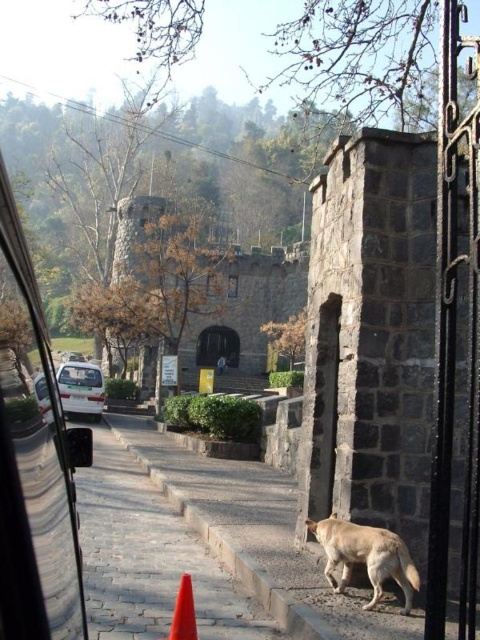
You are driving a car and see the image through your window. There is a point marked at coordinate (34,460) on the window. What object is located at that point?

The point at coordinate (34,460) marks the location of the transparent glass car window at left.

You are driving a car and see the transparent glass car window at left and the paved stone pavement at center. Which object is closer to the left side of your view?

The transparent glass car window at left is positioned on the left side of the paved stone pavement at center, so it is closer to the left side of your view.